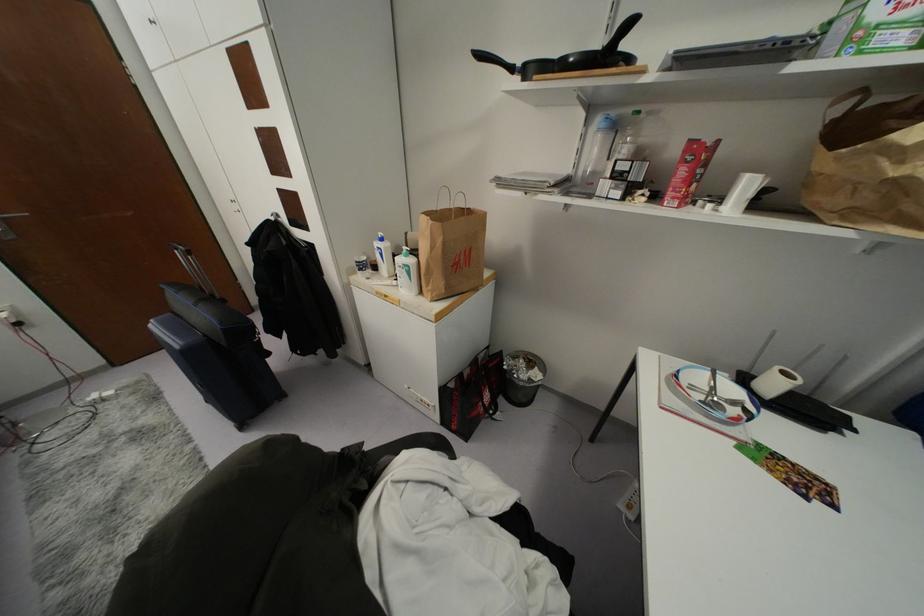
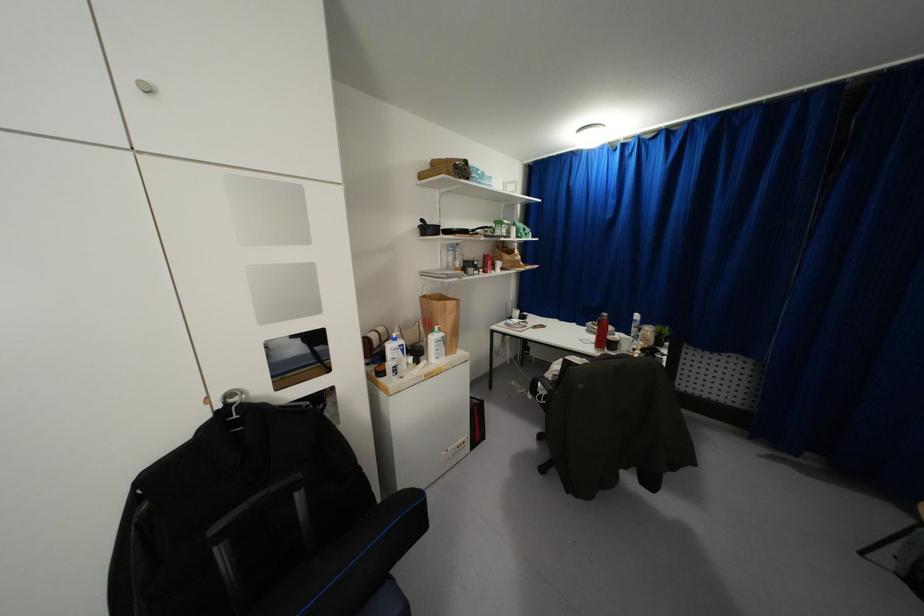
Locate, in the second image, the point that corresponds to the point at 479,55 in the first image.

(421, 220)